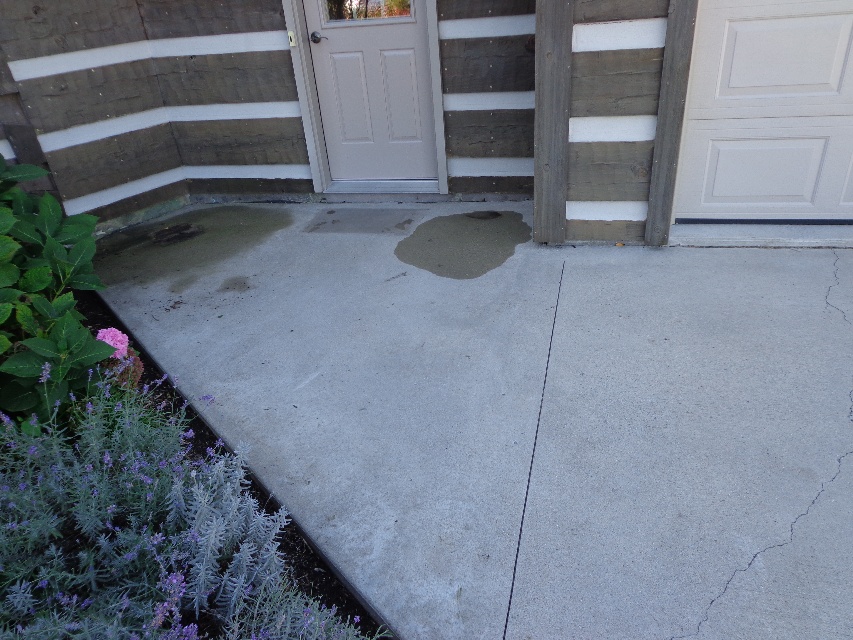
You are a gardener who needs to water the purple fuzzy plant at lower left. The concrete wet patch at center is already there. Which area should you avoid to prevent overwatering the plant?

The concrete wet patch at center is larger in size than the purple fuzzy plant at lower left, so you should avoid the concrete wet patch at center to prevent overwatering the plant.